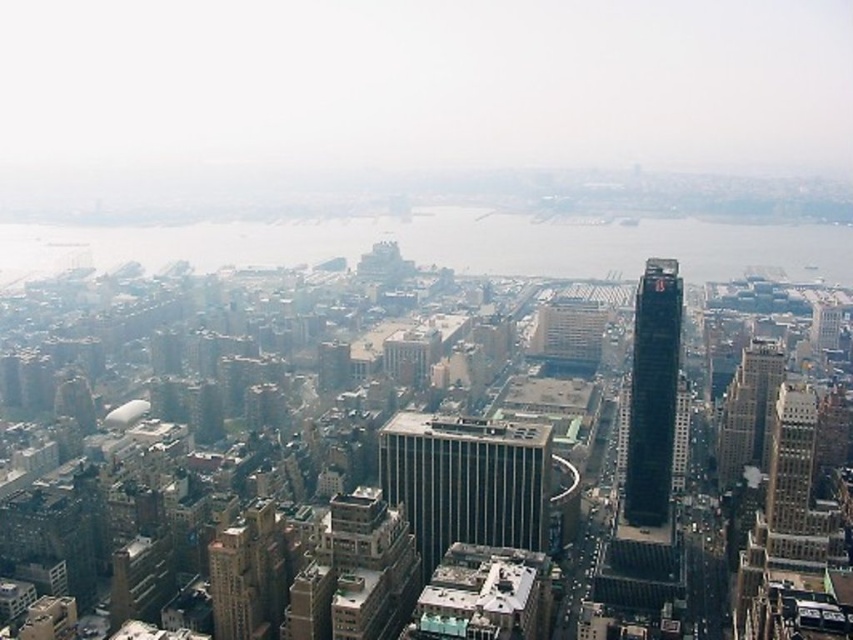
You are a drone operator who needs to fly a drone to a specific point in the city. The point is labeled as point (541, 536). Given that the drone has a maximum flight range of 600 meters, will it be able to reach this point?

The distance of point (541, 536) from the camera is 644.45 meters, which exceeds the drone maximum flight range of 600 meters. Therefore, the drone cannot reach the point.